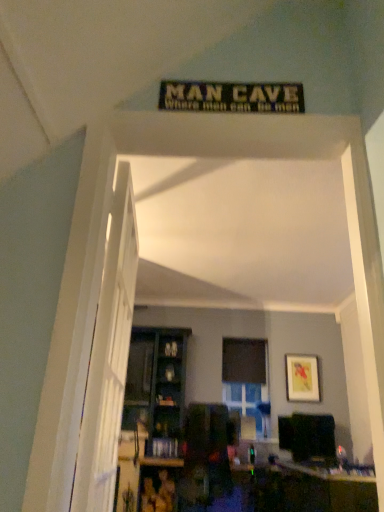
Describe the element at coordinates (302, 378) in the screenshot. I see `matte wooden picture frame at upper right` at that location.

Image resolution: width=384 pixels, height=512 pixels. What are the coordinates of `matte wooden picture frame at upper right` in the screenshot? It's located at (302, 378).

At what (x,y) coordinates should I click in order to perform the action: click on matte wooden picture frame at upper right. Please return your answer as a coordinate pair (x, y). Image resolution: width=384 pixels, height=512 pixels. Looking at the image, I should click on (302, 378).